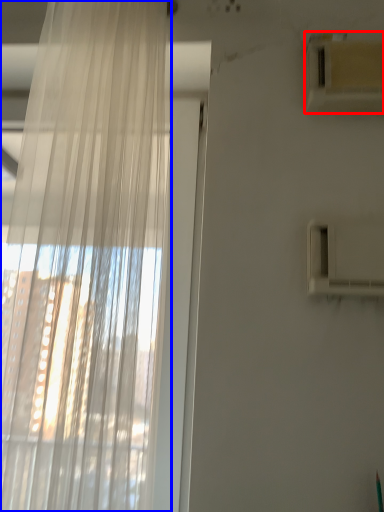
Question: Which object appears closest to the camera in this image, air conditioning (highlighted by a red box) or curtain (highlighted by a blue box)?

Choices:
 (A) air conditioning
 (B) curtain

Answer: (B)